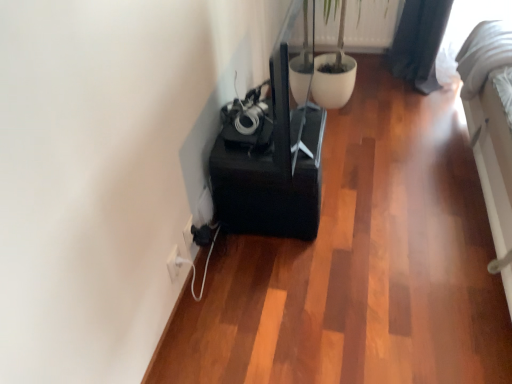
Question: Would you say white plastic electric outlet at lower left, the 2th electric outlet from the front, is to the left or to the right of green matte plant at upper center in the picture?

Choices:
 (A) left
 (B) right

Answer: (A)

Question: From the image's perspective, is white plastic electric outlet at lower left, the 2th electric outlet from the front, above or below green matte plant at upper center?

Choices:
 (A) above
 (B) below

Answer: (B)

Question: Which object is positioned closest to the white plastic electric outlet at lower left, which is the 2th electric outlet from right to left?

Choices:
 (A) green matte plant at upper center
 (B) white plastic electric outlet at lower left, the 2th electric outlet from the front

Answer: (B)

Question: Estimate the real-world distances between objects in this image. Which object is closer to the white plastic electric outlet at lower left, the 1th electric outlet from the right?

Choices:
 (A) green matte plant at upper center
 (B) white plastic electric outlet at lower left, positioned as the 1th electric outlet in left-to-right order

Answer: (B)